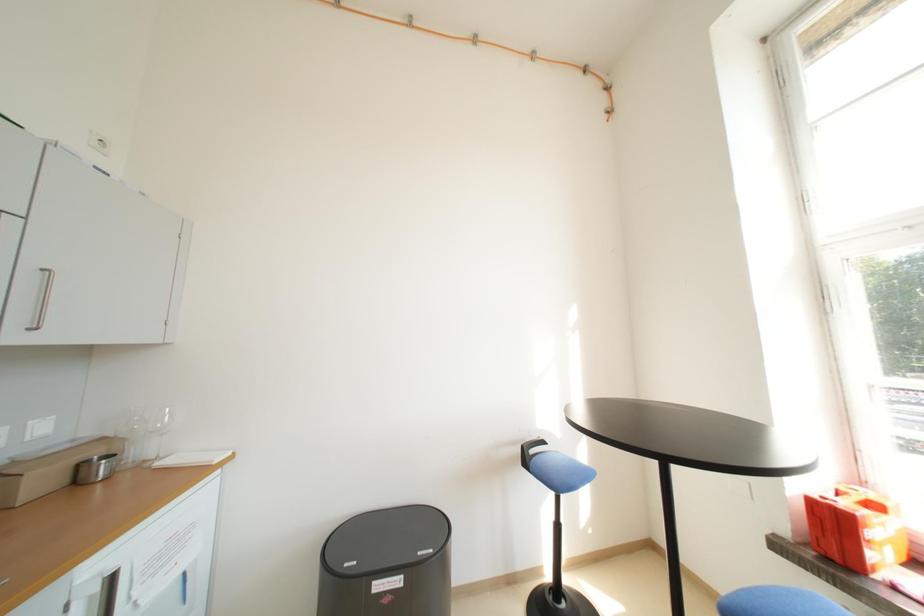
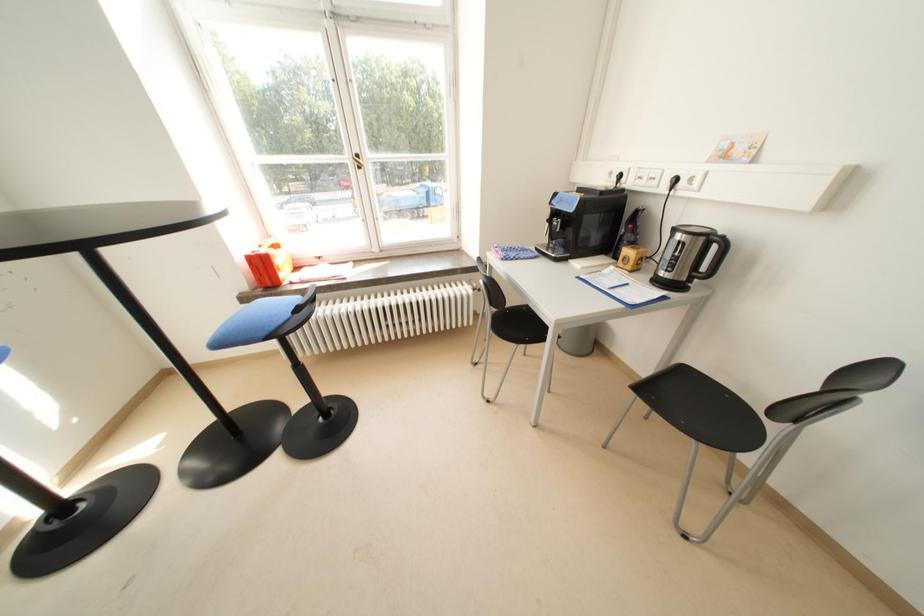
First-person continuous shooting, in which direction is the camera rotating?

The camera rotated toward right-down.